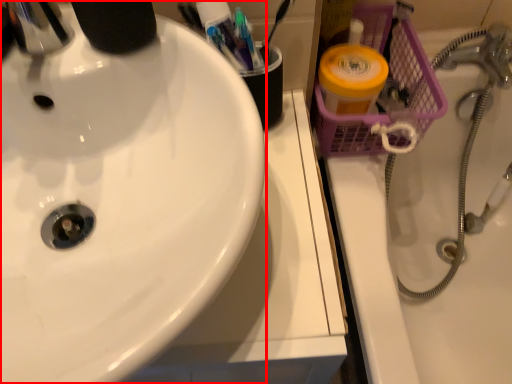
Question: From the image, what is the correct spatial relationship of sink (annotated by the red box) in relation to bath?

Choices:
 (A) right
 (B) left

Answer: (B)